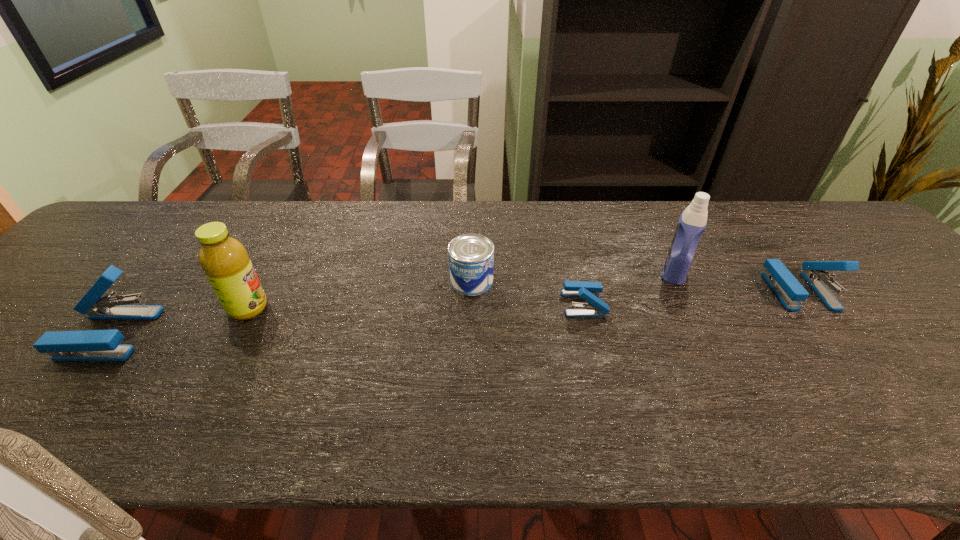
Please mark a free spot for a new stapler_(stapling_machine) to balance the arrangement. Please provide its 2D coordinates. Your answer should be formatted as a tuple, i.e. [(x, y)], where the tuple contains the x and y coordinates of a point satisfying the conditions above.

[(354, 318)]